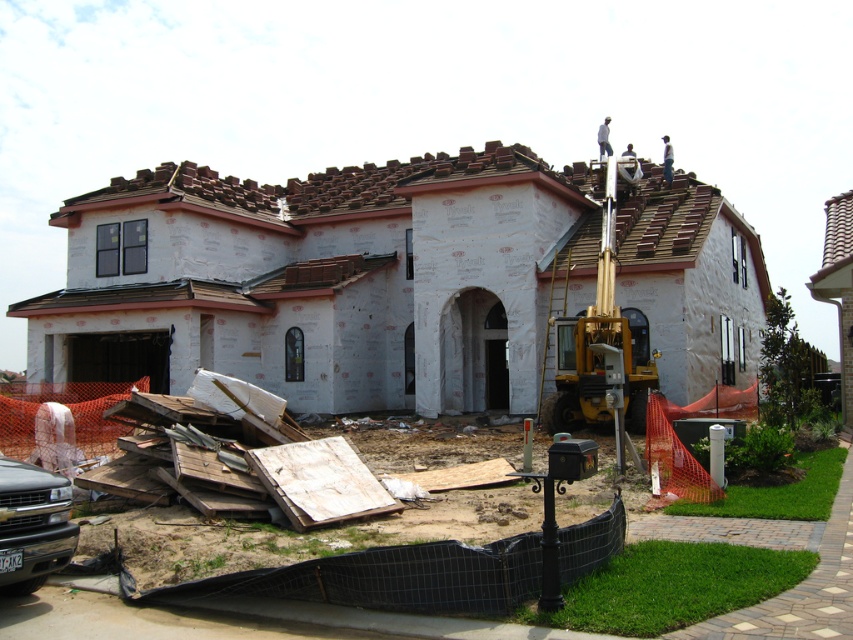
Can you confirm if white foam insulation at lower left is smaller than matte black truck at lower left?

Incorrect, white foam insulation at lower left is not smaller in size than matte black truck at lower left.

Does white foam insulation at lower left have a greater height compared to matte black truck at lower left?

Yes, white foam insulation at lower left is taller than matte black truck at lower left.

Is point (170, 403) behind point (6, 528)?

That is True.

Find the location of a particular element. white foam insulation at lower left is located at coordinates tap(730, 531).